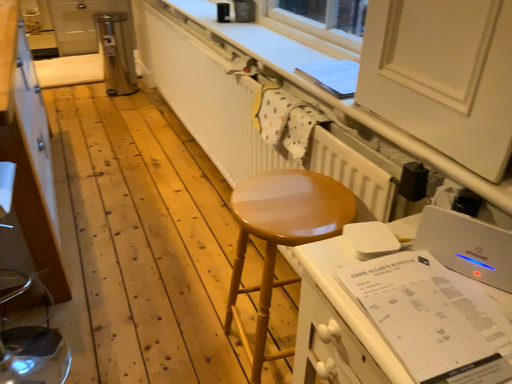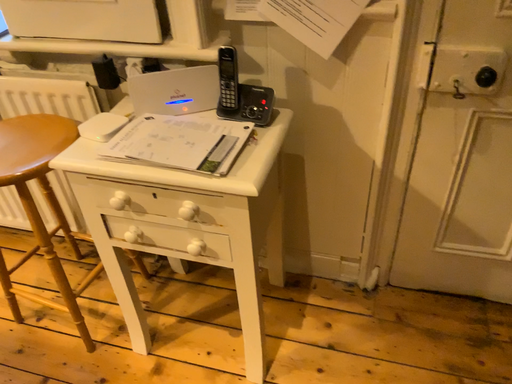
Question: How did the camera likely rotate when shooting the video?

Choices:
 (A) rotated downward
 (B) rotated upward

Answer: (B)